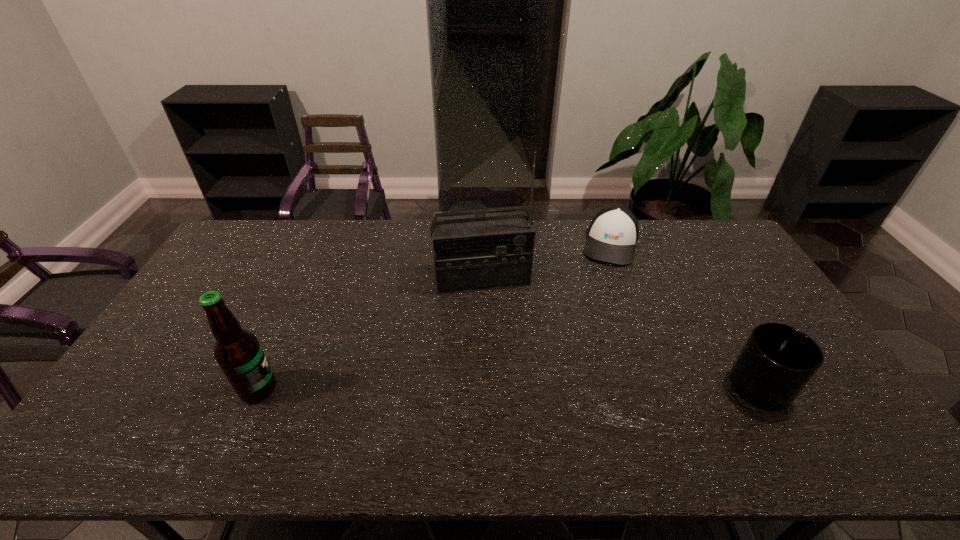
Locate an element on the screen. The width and height of the screenshot is (960, 540). the leftmost object is located at coordinates (238, 352).

In order to click on beer bottle in this screenshot , I will do `click(238, 352)`.

Where is `the third tallest object`? The width and height of the screenshot is (960, 540). the third tallest object is located at coordinates (777, 361).

At what (x,y) coordinates should I click in order to perform the action: click on the rightmost object. Please return your answer as a coordinate pair (x, y). The width and height of the screenshot is (960, 540). Looking at the image, I should click on [x=777, y=361].

Where is `the tallest object`? This screenshot has width=960, height=540. the tallest object is located at coordinates (492, 251).

At what (x,y) coordinates should I click in order to perform the action: click on the third object from right to left. Please return your answer as a coordinate pair (x, y). The image size is (960, 540). Looking at the image, I should click on 492,251.

Where is `the third object from left to right`? Image resolution: width=960 pixels, height=540 pixels. the third object from left to right is located at coordinates (613, 233).

I want to click on cap, so click(x=613, y=233).

The image size is (960, 540). I want to click on free region located on the label of the beer bottle, so click(x=312, y=389).

The image size is (960, 540). Identify the location of vacant space situated 0.340m on the front panel of the radio receiver. (509, 382).